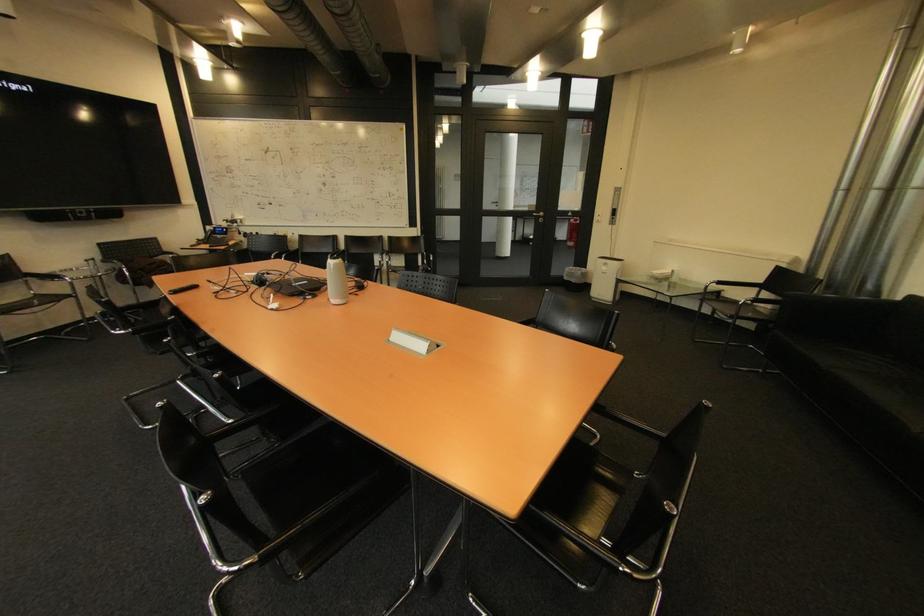
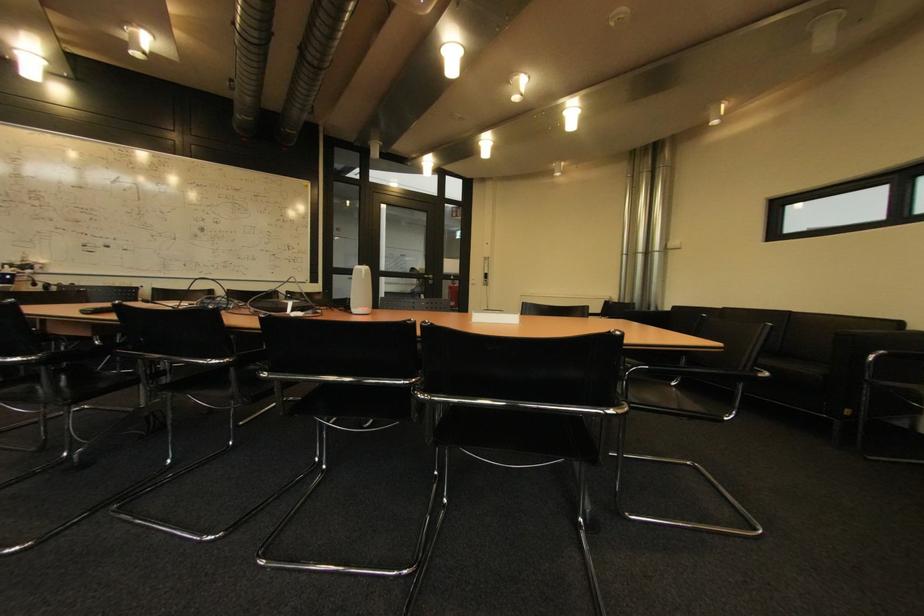
Locate, in the second image, the point that corresponds to (x=127, y=331) in the first image.

(22, 358)